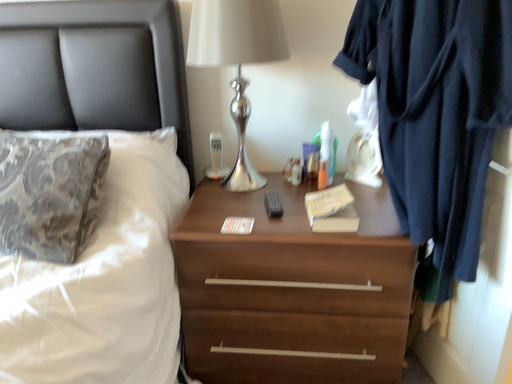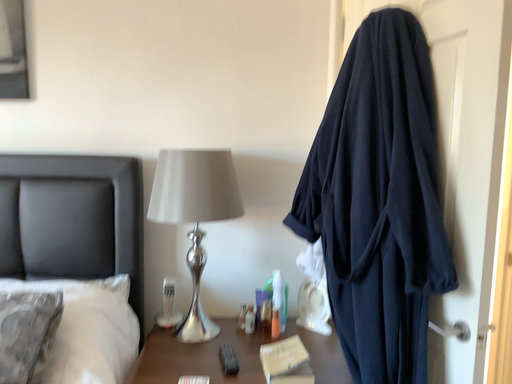
Question: Which way did the camera rotate in the video?

Choices:
 (A) rotated downward
 (B) rotated upward

Answer: (B)